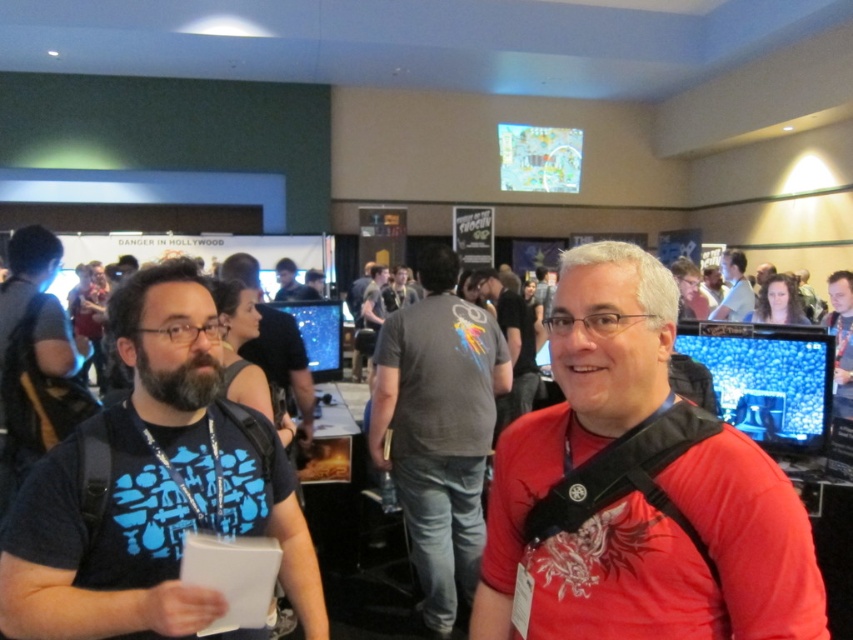
You are organizing a photo shoot in this convention hall and need to place two shirts on a display stand. The red matte shirt at center and the matte black shirt at center must be arranged so that the one taking up more space is placed first. Which shirt should you place first?

The matte black shirt at center occupies more space than the red matte shirt at center, so you should place the matte black shirt at center first.

You are at the gaming convention and want to locate the red matte shirt at center. According to the coordinates provided, where would you look?

You should look at point 0.748 on the y axis and 0.769 on the x axis to find the red matte shirt at center.